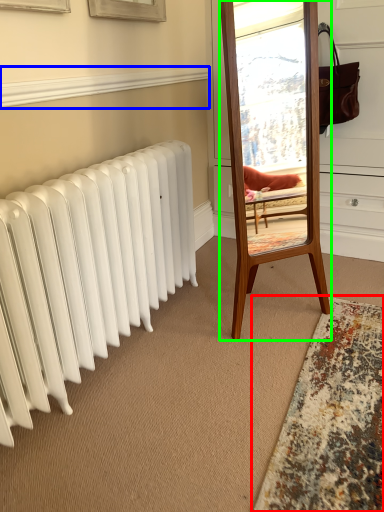
Question: Estimate the real-world distances between objects in this image. Which object is farther from mat (highlighted by a red box), window sill (highlighted by a blue box) or mirror (highlighted by a green box)?

Choices:
 (A) window sill
 (B) mirror

Answer: (A)